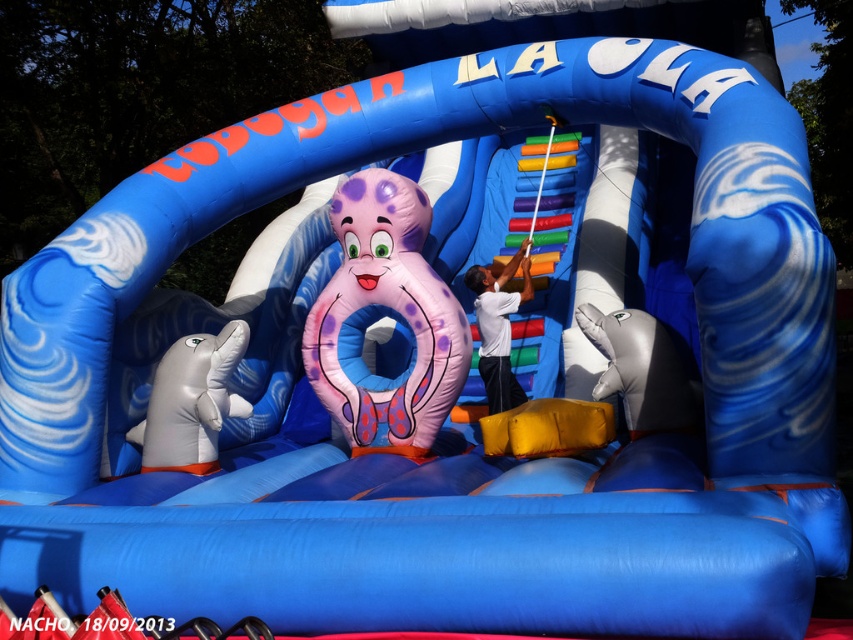
Question: Is white rubber dolphin at lower left wider than metallic silver dolphin at lower right?

Choices:
 (A) no
 (B) yes

Answer: (B)

Question: Which of these objects is positioned closest to the pink rubber octopus at center?

Choices:
 (A) white smooth shirt at center
 (B) white rubber dolphin at lower left

Answer: (A)

Question: Does pink rubber octopus at center appear over white rubber dolphin at lower left?

Choices:
 (A) no
 (B) yes

Answer: (B)

Question: Based on their relative distances, which object is nearer to the metallic silver dolphin at lower right?

Choices:
 (A) white smooth shirt at center
 (B) pink rubber octopus at center

Answer: (A)

Question: Which of the following is the farthest from the observer?

Choices:
 (A) (631, 356)
 (B) (221, 339)

Answer: (B)

Question: Can you confirm if pink rubber octopus at center is thinner than white rubber dolphin at lower left?

Choices:
 (A) no
 (B) yes

Answer: (A)